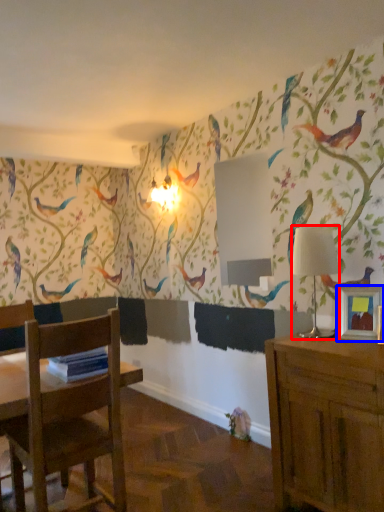
Question: Which object appears closest to the camera in this image, lamp (highlighted by a red box) or picture frame (highlighted by a blue box)?

Choices:
 (A) lamp
 (B) picture frame

Answer: (B)